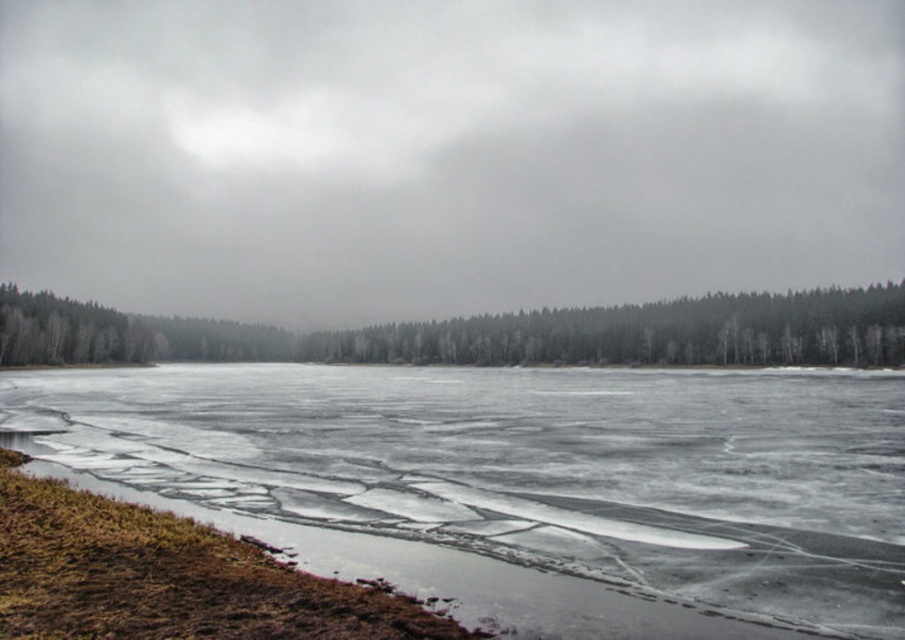
You are an ice skater standing on the frozen lake. You see the translucent ice at lower left and the green matte trees at center. Which object is closer to your current position?

The translucent ice at lower left is closer to your current position because it is positioned on the right side of the green matte trees at center, which are further away.

You are an ice skater standing on the frozen lake. You see the translucent ice at lower left and the green matte trees at center. Which object is closer to you?

The translucent ice at lower left is closer to you because it is not as tall as the green matte trees at center, indicating it is positioned in the foreground.

You are an ice skater planning to glide across the frozen lake. You notice the translucent ice at lower left and the green matte trees at center. Which object is positioned closer to the edge of the lake?

The translucent ice at lower left is located below the green matte trees at center, so it is closer to the edge of the lake.